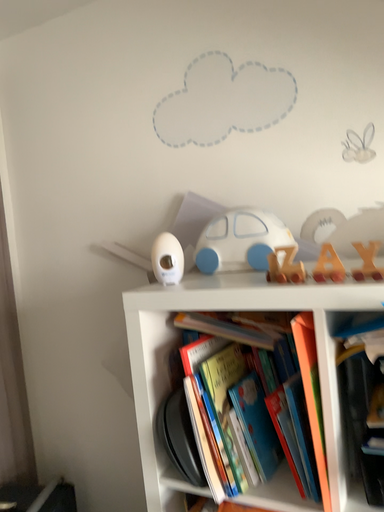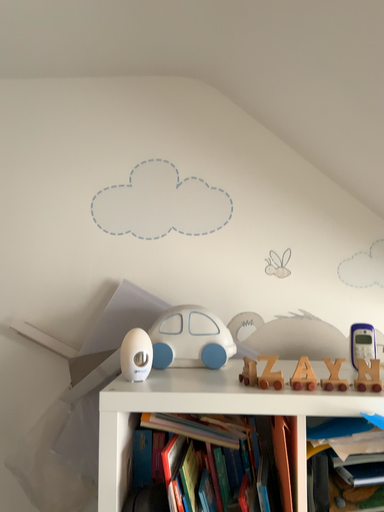
Question: Which way did the camera rotate in the video?

Choices:
 (A) rotated downward
 (B) rotated upward

Answer: (B)